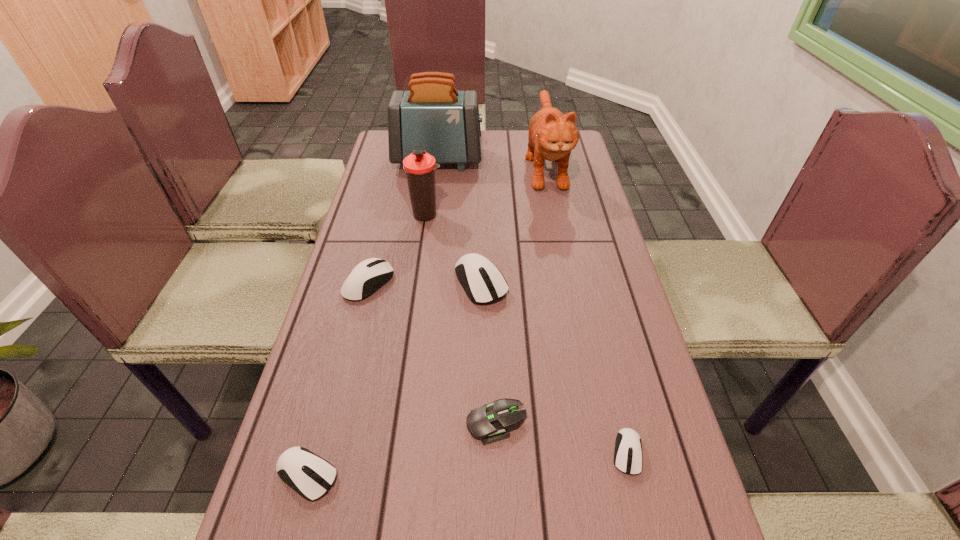
Find the location of `free location at the right edge of the desktop`. free location at the right edge of the desktop is located at coordinates (583, 174).

The height and width of the screenshot is (540, 960). Find the location of `blank space at the far left corner`. blank space at the far left corner is located at coordinates (388, 154).

I want to click on empty space between the third white mouse from left to right and the second smallest white mouse, so click(x=394, y=379).

The height and width of the screenshot is (540, 960). In order to click on free space between the second smallest white mouse and the sixth shortest object in this screenshot , I will do `click(367, 345)`.

In order to click on free area in between the smallest white mouse and the third shortest object in this screenshot , I will do `click(468, 463)`.

Where is `free space between the brown thermos bottle and the rightmost white mouse`? free space between the brown thermos bottle and the rightmost white mouse is located at coordinates point(527,334).

Locate an element on the screen. free area in between the rightmost white mouse and the gray computer mouse is located at coordinates (562, 438).

The image size is (960, 540). In order to click on vacant space in between the brown thermos bottle and the third smallest white mouse in this screenshot , I will do `click(397, 248)`.

The image size is (960, 540). In order to click on object identified as the third closest to the sixth tallest object in this screenshot , I will do `click(482, 281)`.

You are a GUI agent. You are given a task and a screenshot of the screen. Output one action in this format:
    pyautogui.click(x=<x>, y=<y>)
    Task: Click on the object that stands as the third closest to the gray computer mouse
    The height and width of the screenshot is (540, 960).
    Given the screenshot: What is the action you would take?
    pyautogui.click(x=482, y=281)